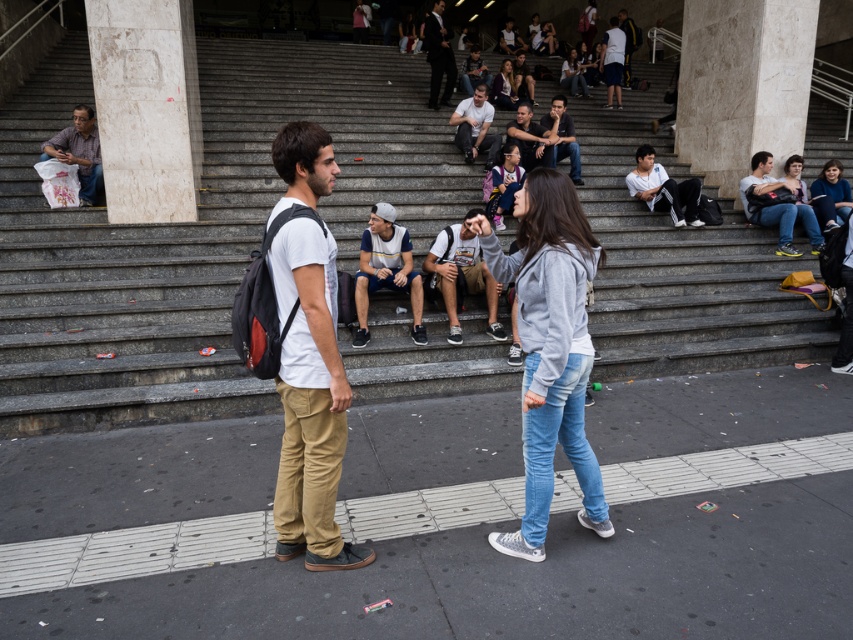
Question: Can you confirm if marble column at upper right is wider than gray knit cap at center?

Choices:
 (A) yes
 (B) no

Answer: (A)

Question: Does dark gray backpack at center have a larger size compared to dark gray backpack at upper right?

Choices:
 (A) no
 (B) yes

Answer: (A)

Question: Is gray knit cap at center below white cotton shirt at upper right?

Choices:
 (A) yes
 (B) no

Answer: (A)

Question: Which of these objects is positioned farthest from the dark suit at center?

Choices:
 (A) concrete stairs at center
 (B) white cotton t-shirt at center

Answer: (B)

Question: Estimate the real-world distances between objects in this image. Which object is closer to the dark gray backpack at right?

Choices:
 (A) dark gray backpack at center
 (B) white marble pillar at upper left
 (C) white matte shirt at center
 (D) dark blue jeans at center

Answer: (D)

Question: Which point is farther to the camera?

Choices:
 (A) (36, 372)
 (B) (518, 124)
 (C) (474, 92)
 (D) (305, 420)

Answer: (C)